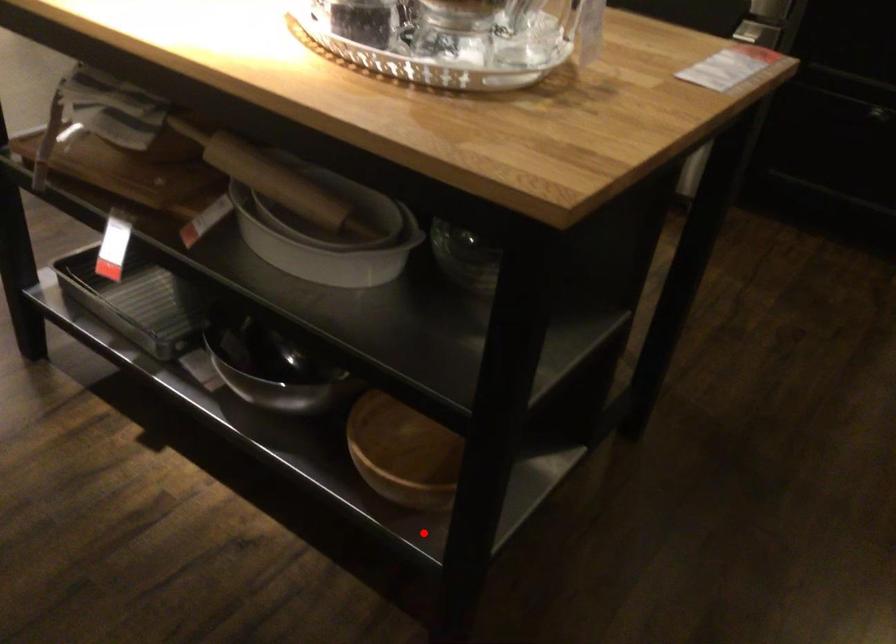
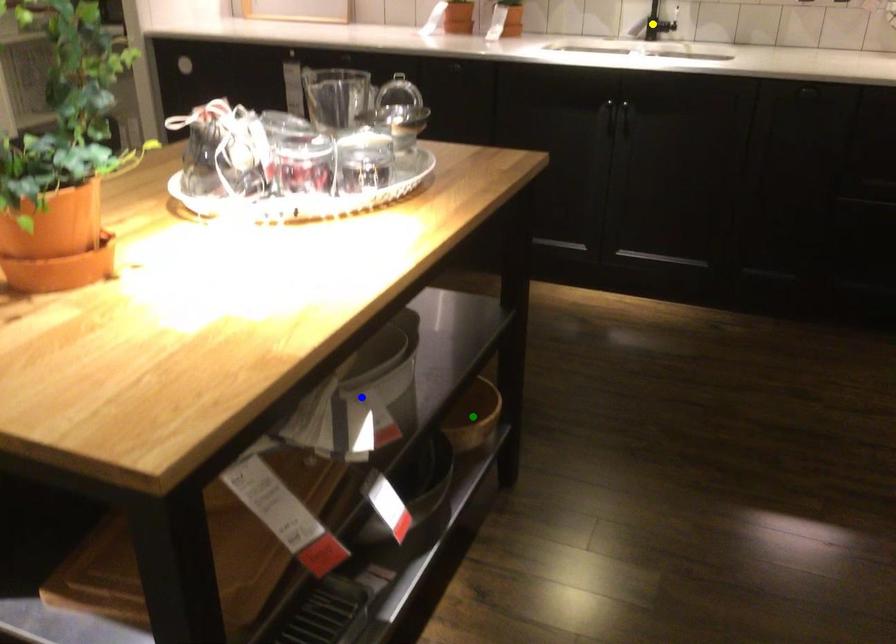
Question: I am providing you with two images of the same scene from different viewpoints. A red point is marked on the first image. You are given multiple points on the second image. Can you choose the point in image 2 that corresponds to the point in image 1?

Choices:
 (A) green point
 (B) blue point
 (C) yellow point

Answer: (A)